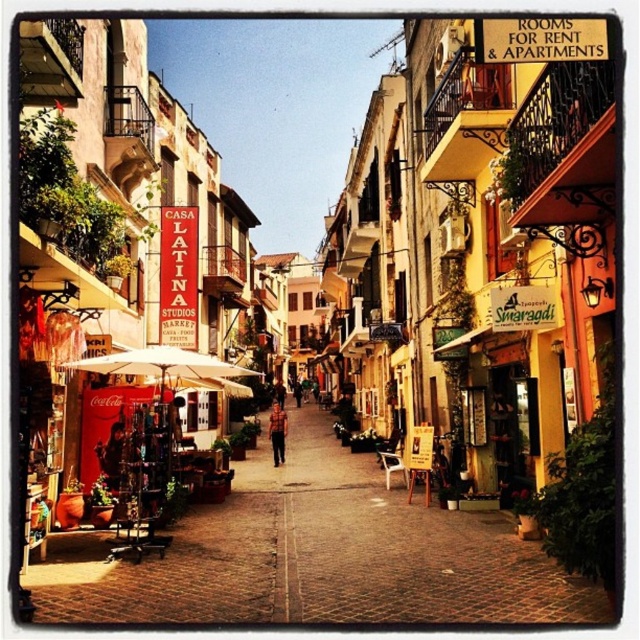
You are walking along the cobblestone street and want to reach the point marked as point (282, 461). However, there is an obstacle at point (173, 397). Can you safely navigate around the obstacle to reach your destination?

Yes, you can safely navigate around the obstacle because point (282, 461) is behind point (173, 397), meaning it is positioned further back from the obstacle.